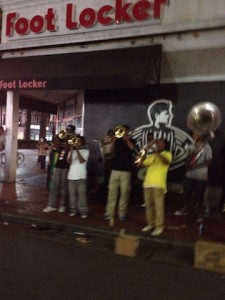
The height and width of the screenshot is (300, 225). What are the coordinates of `black wall` in the screenshot? It's located at (135, 110).